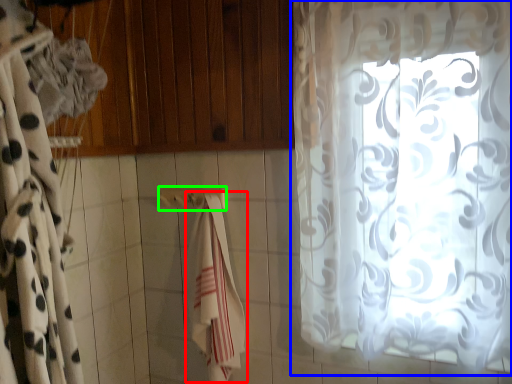
Question: Which is nearer to the beach towel (highlighted by a red box)? curtain (highlighted by a blue box) or towel bar (highlighted by a green box).

Choices:
 (A) curtain
 (B) towel bar

Answer: (B)